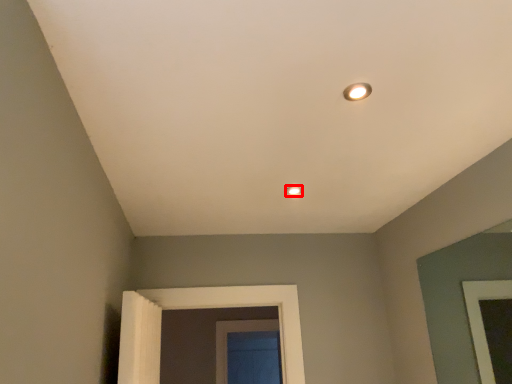
Question: Where is lamp (annotated by the red box) located in relation to light in the image?

Choices:
 (A) left
 (B) right

Answer: (A)